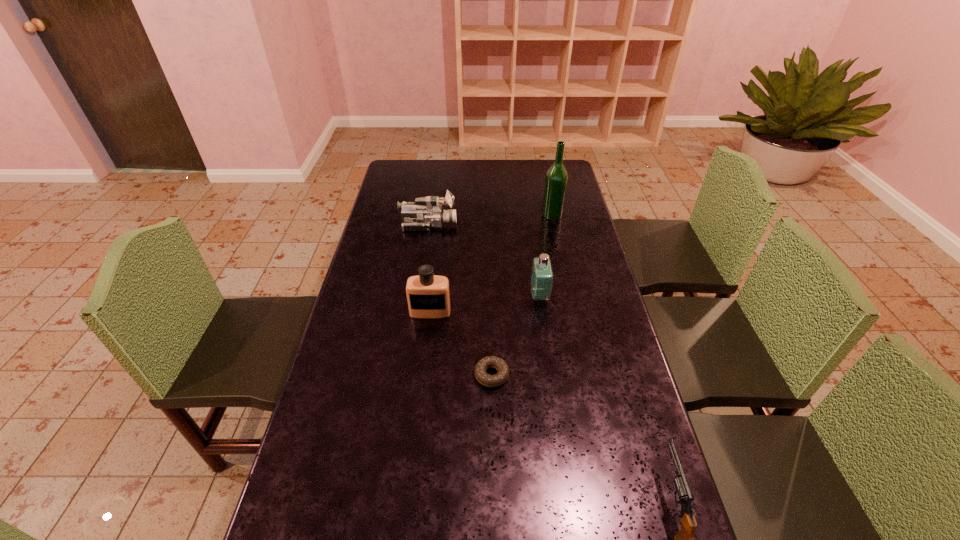
Locate an element on the screen. This screenshot has width=960, height=540. free location that satisfies the following two spatial constraints: 1. on the back side of the second object from right to left; 2. on the right side of the doughnut is located at coordinates (488, 214).

Where is `vacant space that satisfies the following two spatial constraints: 1. on the front side of the tallest object; 2. on the front-facing side of the camcorder`? This screenshot has height=540, width=960. vacant space that satisfies the following two spatial constraints: 1. on the front side of the tallest object; 2. on the front-facing side of the camcorder is located at coordinates (554, 225).

This screenshot has width=960, height=540. I want to click on vacant region that satisfies the following two spatial constraints: 1. on the front side of the tallest object; 2. on the front-facing side of the camcorder, so tap(554, 225).